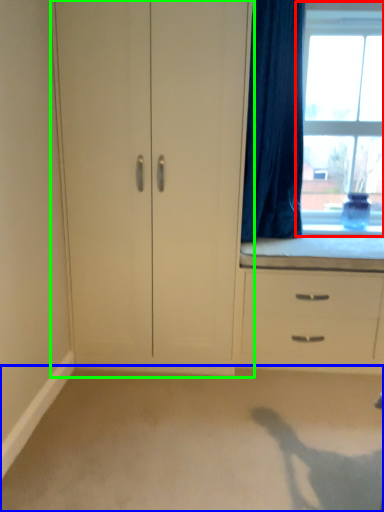
Question: Which object is the closest to the window (highlighted by a red box)? Choose among these: plain (highlighted by a blue box) or cupboard (highlighted by a green box).

Choices:
 (A) plain
 (B) cupboard

Answer: (B)